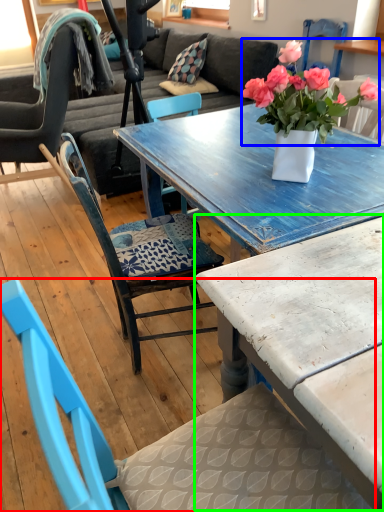
Question: Which object is positioned closest to chair (highlighted by a red box)? Select from flower (highlighted by a blue box) and coffee table (highlighted by a green box).

Choices:
 (A) flower
 (B) coffee table

Answer: (B)